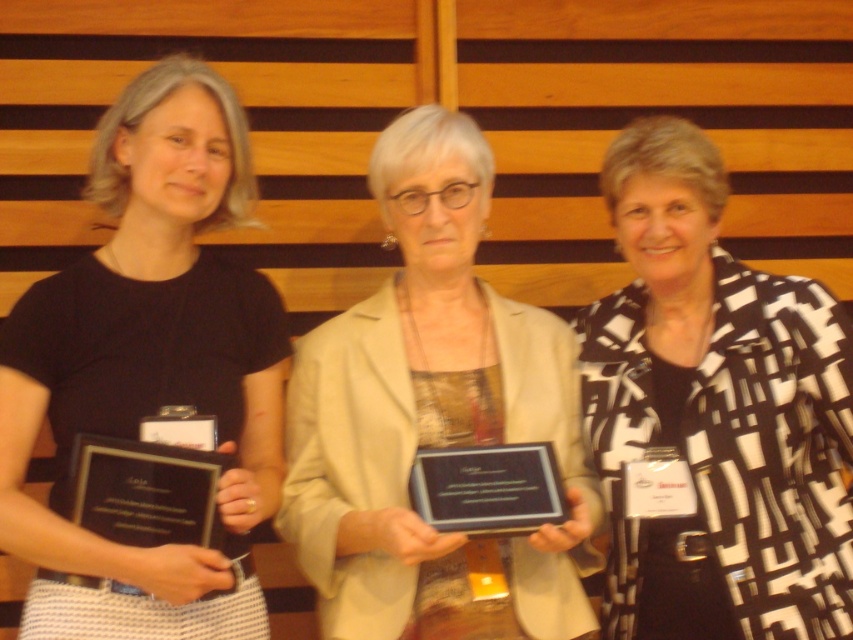
Does beige fabric jacket at center appear under black glossy plaque at left?

Incorrect, beige fabric jacket at center is not positioned below black glossy plaque at left.

Who is positioned more to the left, beige fabric jacket at center or black glossy plaque at left?

From the viewer's perspective, black glossy plaque at left appears more on the left side.

In order to click on beige fabric jacket at center in this screenshot , I will do `click(432, 419)`.

Is point (126, 522) positioned in front of point (479, 492)?

That is True.

Which is in front, point (68, 474) or point (434, 474)?

Positioned in front is point (68, 474).

Is point (114, 538) farther from viewer compared to point (454, 465)?

No, (114, 538) is in front of (454, 465).

Where is `black glossy plaque at left`? black glossy plaque at left is located at coordinates (144, 492).

What do you see at coordinates (432, 419) in the screenshot? I see `beige fabric jacket at center` at bounding box center [432, 419].

Is point (519, 419) less distant than point (526, 518)?

No, (519, 419) is further to viewer.

Locate an element on the screen. beige fabric jacket at center is located at coordinates (432, 419).